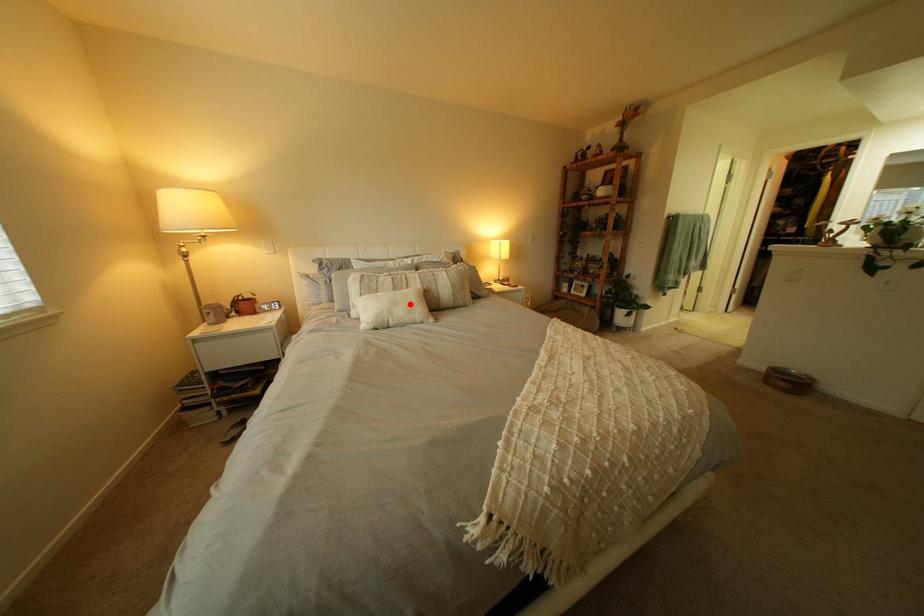
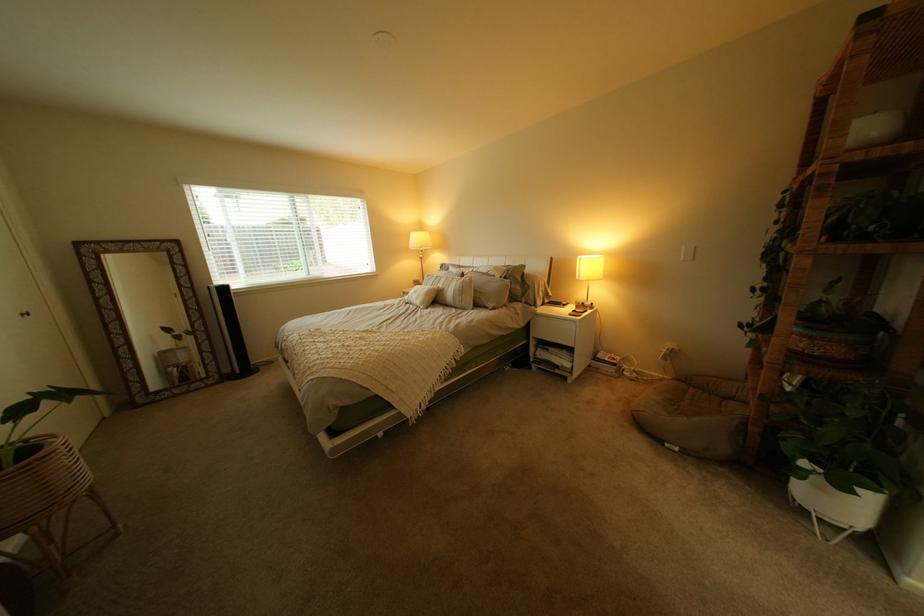
Question: I am providing you with two images of the same scene from different viewpoints. A red point is marked on the first image. Can you still see the location of the red point in image 2?

Choices:
 (A) Yes
 (B) No

Answer: (A)